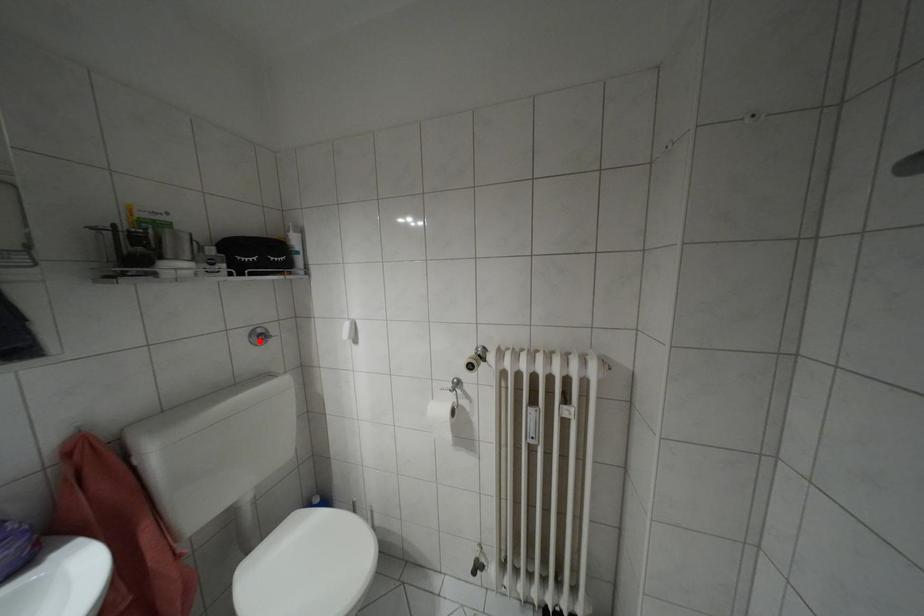
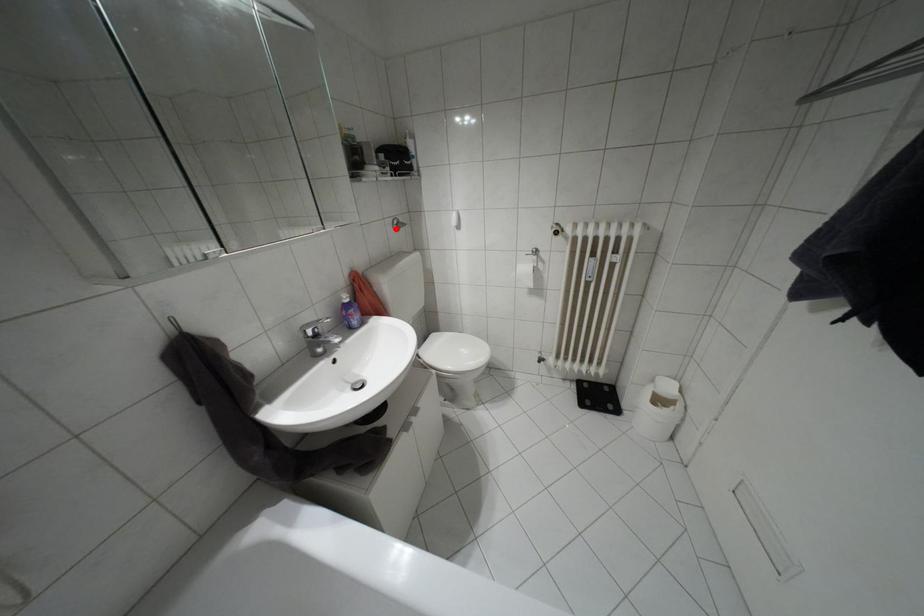
I am providing you with two images of the same scene from different viewpoints. A red point is marked on the first image and another point is marked on the second image. Are the points marked in image1 and image2 representing the same 3D position?

Yes